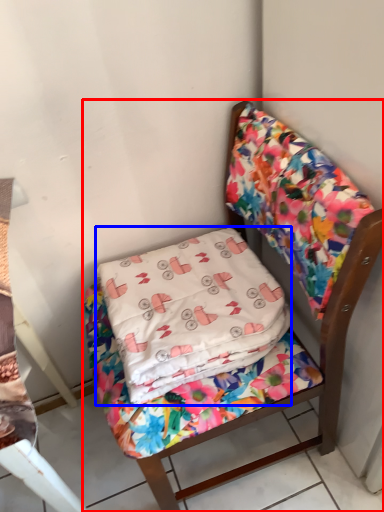
Question: Which object appears farthest to the camera in this image, chair (highlighted by a red box) or pillow (highlighted by a blue box)?

Choices:
 (A) chair
 (B) pillow

Answer: (B)